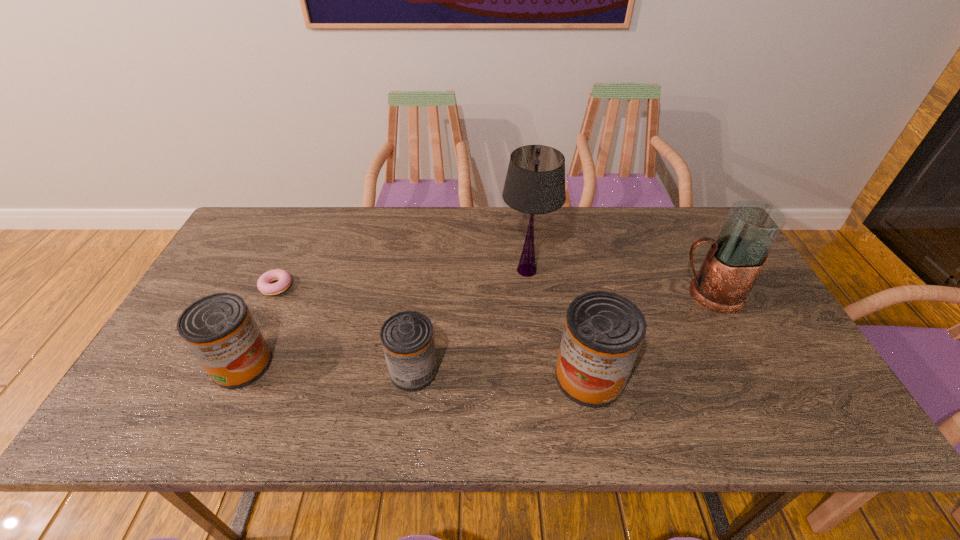
At what (x,y) coordinates should I click in order to perform the action: click on vacant space located on the back of the second shortest object. Please return your answer as a coordinate pair (x, y). Looking at the image, I should click on (428, 258).

The image size is (960, 540). I want to click on vacant space located on the left of the rightmost can, so click(x=396, y=377).

The height and width of the screenshot is (540, 960). In order to click on vacant point located with the handle on the side of the rightmost object in this screenshot , I will do `click(609, 294)`.

This screenshot has height=540, width=960. I want to click on free space located 0.250m with the handle on the side of the rightmost object, so click(584, 294).

I want to click on free space located 0.270m with the handle on the side of the rightmost object, so click(577, 294).

Locate an element on the screen. vacant space positioned on the right of the shortest object is located at coordinates (429, 286).

Locate an element on the screen. The width and height of the screenshot is (960, 540). blank space located on the front-facing side of the tallest object is located at coordinates (537, 363).

Where is `object that is at the far edge`? object that is at the far edge is located at coordinates (535, 182).

Where is `can located at the left edge`? This screenshot has height=540, width=960. can located at the left edge is located at coordinates (219, 329).

Locate an element on the screen. The width and height of the screenshot is (960, 540). doughnut that is at the left edge is located at coordinates (263, 284).